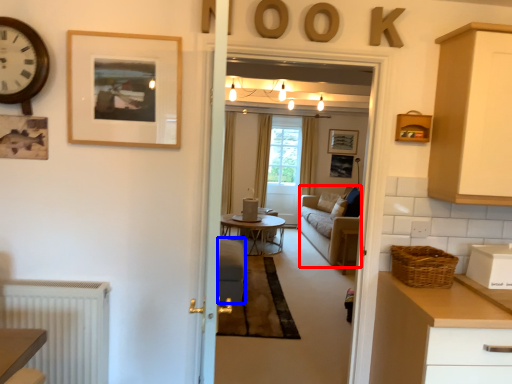
Question: Among these objects, which one is nearest to the camera, couch (highlighted by a red box) or armchair (highlighted by a blue box)?

Choices:
 (A) couch
 (B) armchair

Answer: (B)